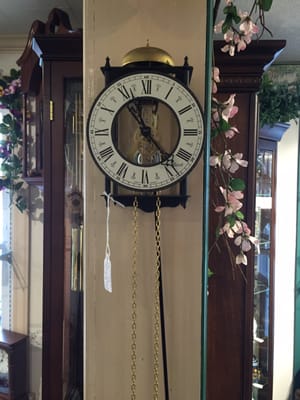
This screenshot has width=300, height=400. What are the coordinates of `clock` in the screenshot? It's located at (8, 365), (180, 132).